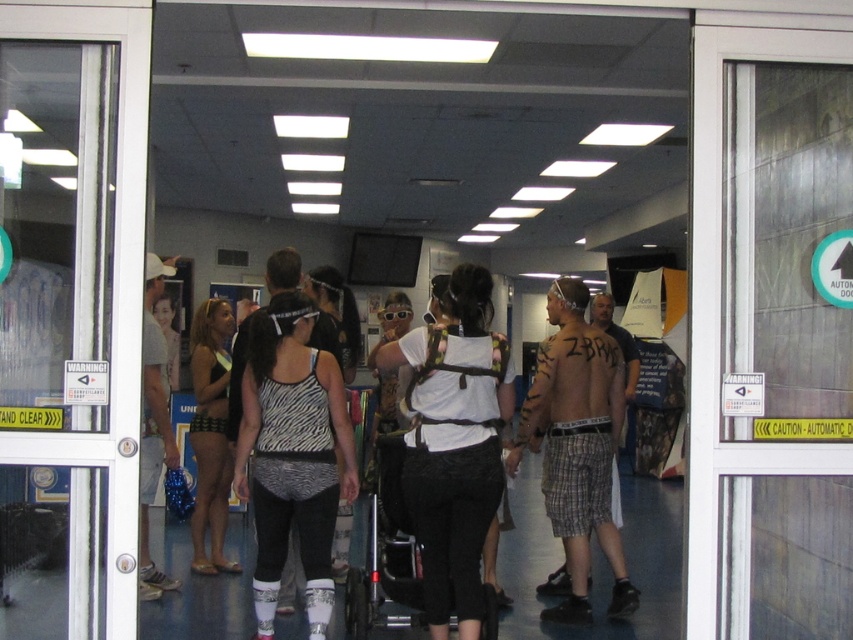
Question: Which object is positioned farthest from the white glass door at center?

Choices:
 (A) transparent glass door at center
 (B) black swimsuit at center
 (C) zebra print tank top at center
 (D) plaid shorts at center

Answer: (D)

Question: In this image, where is black swimsuit at center located relative to white matte tank top at left?

Choices:
 (A) above
 (B) below

Answer: (B)

Question: Where is transparent glass door at center located in relation to white matte tank top at left in the image?

Choices:
 (A) above
 (B) below

Answer: (A)

Question: Which point is farther to the camera?

Choices:
 (A) white matte tank top at left
 (B) plaid shorts at center
 (C) white glass door at center
 (D) zebra print tank top at center

Answer: (B)

Question: In this image, where is transparent glass door at center located relative to plaid shorts at center?

Choices:
 (A) below
 (B) above

Answer: (B)

Question: Which of the following is the farthest from the observer?

Choices:
 (A) black swimsuit at center
 (B) white glass door at center
 (C) white matte tank top at center

Answer: (A)